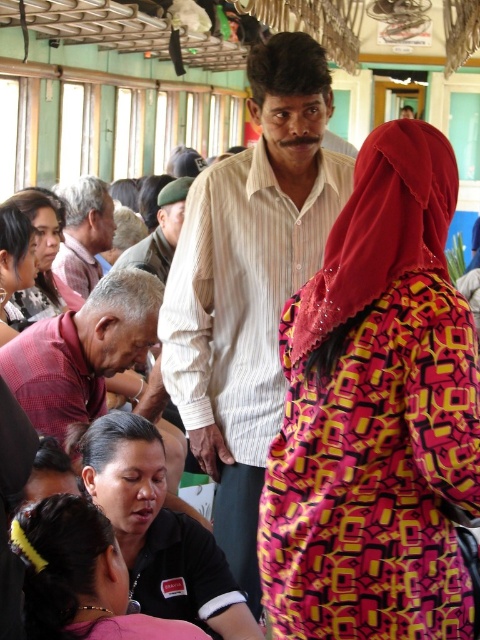
You are standing in the train carriage and want to place a small bag on the pink fabric at lower left. What are the coordinates where you should place it?

The coordinates for placing the small bag on the pink fabric at lower left are at point (80, 577).

You are standing in the train carriage and notice two items, the pink fabric at lower left and the light brown striped shirt at left. Which item has a larger width?

The pink fabric at lower left might be wider than light brown striped shirt at left according to the description.

You are standing in a train carriage and notice two items at the lower left corner of the scene. The items are the pink fabric at lower left and the matte black hair at lower left. Which of these two items is shorter?

The pink fabric at lower left is shorter than the matte black hair at lower left according to the description.